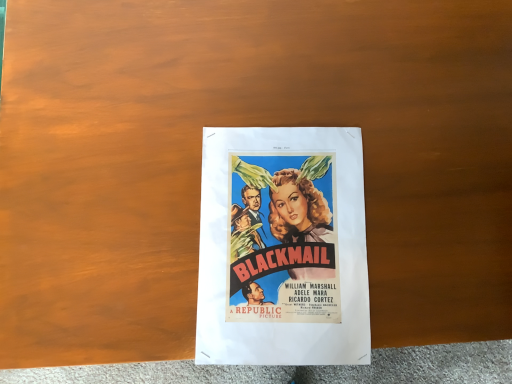
You are a GUI agent. You are given a task and a screenshot of the screen. Output one action in this format:
    pyautogui.click(x=<x>, y=<y>)
    Task: Click on the vacant point to the right of matte paper poster at center
    
    Given the screenshot: What is the action you would take?
    pyautogui.click(x=431, y=238)